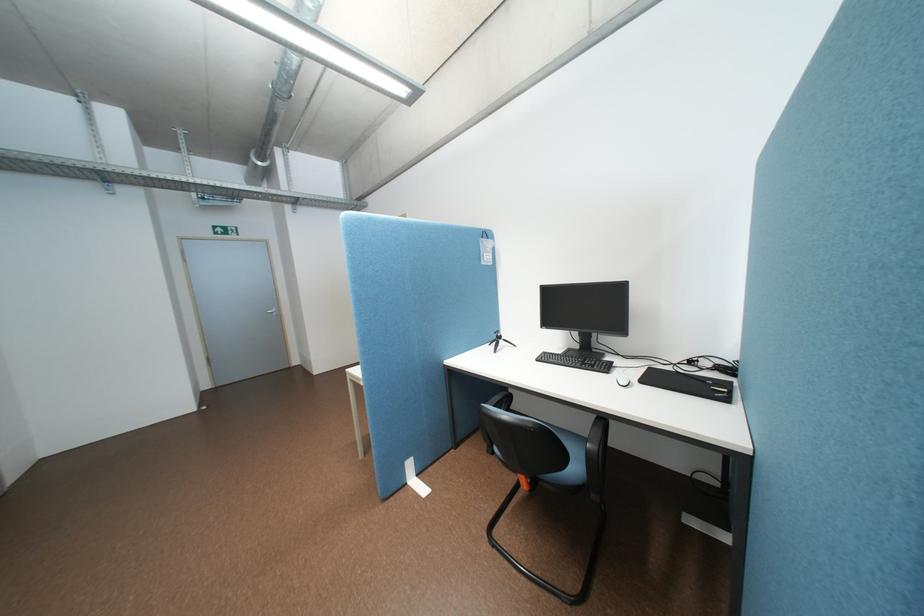
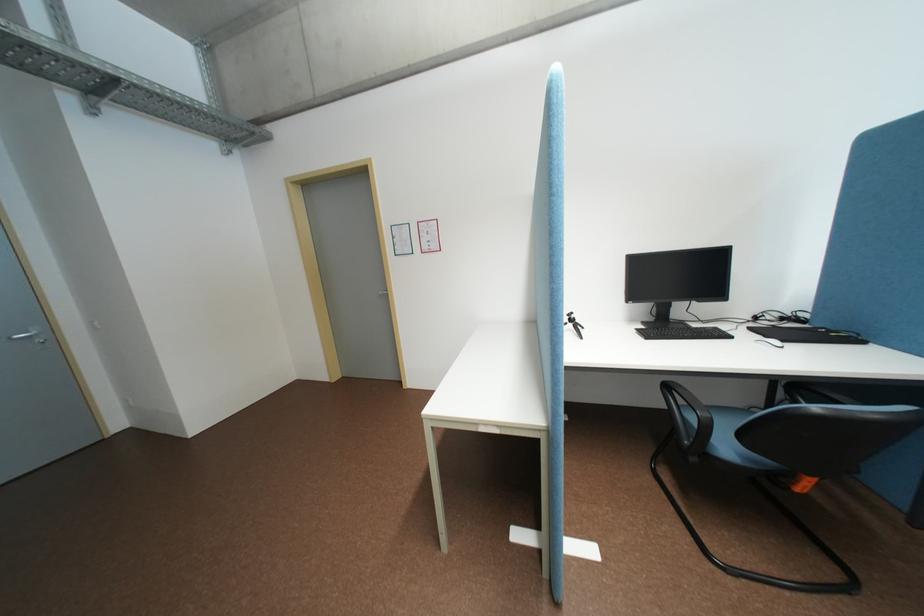
In the second image, find the point that corresponds to point (589, 346) in the first image.

(662, 318)